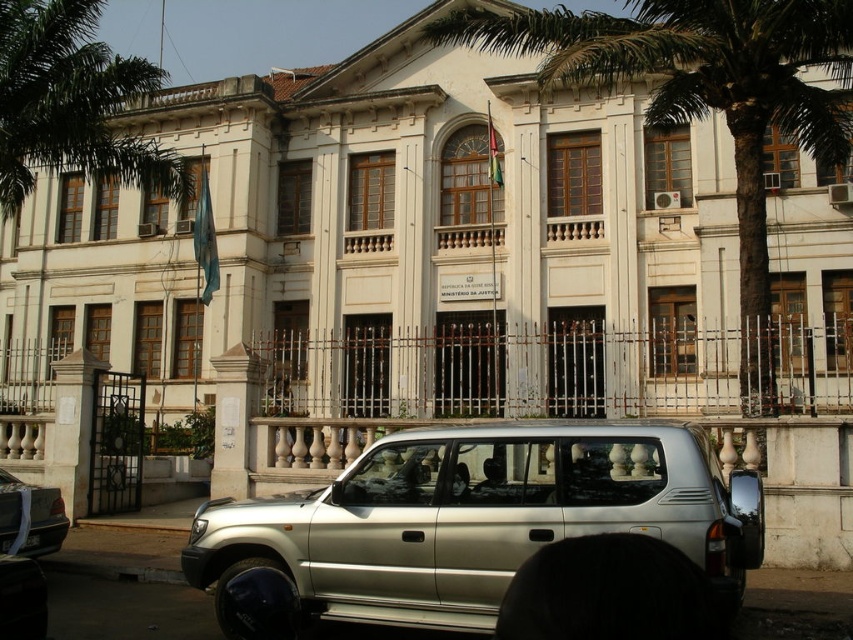
Who is lower down, green leafy palm tree at center or black plastic license plate at center?

black plastic license plate at center is lower down.

Which is in front, point (762, 278) or point (35, 540)?

Point (35, 540) is in front.

Where is `green leafy palm tree at center`? green leafy palm tree at center is located at coordinates (703, 99).

Between silver metallic suv at center and silver metallic suv at lower left, which one appears on the left side from the viewer's perspective?

Positioned to the left is silver metallic suv at lower left.

Which is more to the right, silver metallic suv at center or silver metallic suv at lower left?

From the viewer's perspective, silver metallic suv at center appears more on the right side.

The image size is (853, 640). I want to click on silver metallic suv at center, so click(x=479, y=518).

Can you confirm if green leafy palm tree at upper left is taller than black plastic license plate at center?

Yes, green leafy palm tree at upper left is taller than black plastic license plate at center.

Who is lower down, green leafy palm tree at upper left or black plastic license plate at center?

black plastic license plate at center

Between point (77, 116) and point (38, 536), which one is positioned in front?

Positioned in front is point (38, 536).

At what (x,y) coordinates should I click in order to perform the action: click on green leafy palm tree at upper left. Please return your answer as a coordinate pair (x, y). This screenshot has width=853, height=640. Looking at the image, I should click on (73, 104).